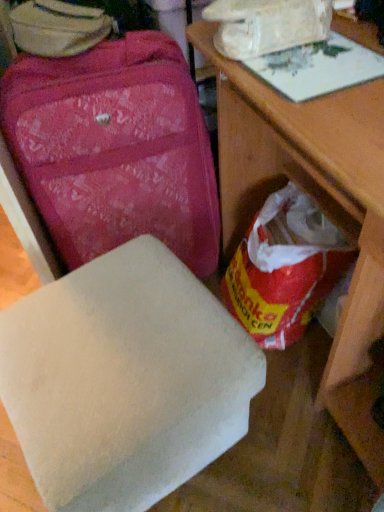
This screenshot has width=384, height=512. What do you see at coordinates (321, 205) in the screenshot? I see `wooden table at center` at bounding box center [321, 205].

What do you see at coordinates (124, 380) in the screenshot? The width and height of the screenshot is (384, 512). I see `white matte foam at lower center` at bounding box center [124, 380].

This screenshot has width=384, height=512. Identify the location of red plastic grocery bag at lower right. (285, 268).

Locate an element on the screen. This screenshot has height=512, width=384. furniture located on the left of red plastic grocery bag at lower right is located at coordinates (124, 380).

Is point (113, 471) positioned in front of point (266, 277)?

That is True.

Measure the distance from white matte foam at lower center to red plastic grocery bag at lower right.

They are 16.20 inches apart.

Based on the photo, is wooden table at center turned away from white matte foam at lower center?

wooden table at center does not have its back to white matte foam at lower center.

Would you say wooden table at center is inside or outside white matte foam at lower center?

wooden table at center is located beyond the bounds of white matte foam at lower center.

Which object is thinner, wooden table at center or white matte foam at lower center?

white matte foam at lower center is thinner.

Does wooden table at center have a larger size compared to white matte foam at lower center?

Yes, wooden table at center is bigger than white matte foam at lower center.

Where is `grocery bag beneath the matte pink suitcase at upper left (from a real-world perspective)`? This screenshot has height=512, width=384. grocery bag beneath the matte pink suitcase at upper left (from a real-world perspective) is located at coordinates (285, 268).

In terms of size, does matte pink suitcase at upper left appear bigger or smaller than red plastic grocery bag at lower right?

Considering their sizes, matte pink suitcase at upper left takes up more space than red plastic grocery bag at lower right.

Choose the correct answer: Is matte pink suitcase at upper left inside red plastic grocery bag at lower right or outside it?

matte pink suitcase at upper left is not enclosed by red plastic grocery bag at lower right.

Considering the relative positions of wooden table at center and red plastic grocery bag at lower right in the image provided, is wooden table at center to the right of red plastic grocery bag at lower right from the viewer's perspective?

Yes.

Are wooden table at center and red plastic grocery bag at lower right located far from each other?

wooden table at center is near red plastic grocery bag at lower right, not far away.

From a real-world perspective, is wooden table at center physically located above or below red plastic grocery bag at lower right?

In terms of real-world spatial position, wooden table at center is above red plastic grocery bag at lower right.

In terms of height, does wooden table at center look taller or shorter compared to red plastic grocery bag at lower right?

Considering their sizes, wooden table at center has more height than red plastic grocery bag at lower right.

Is matte pink suitcase at upper left behind wooden table at center?

Yes, matte pink suitcase at upper left is further from the viewer.

From a real-world perspective, is matte pink suitcase at upper left on top of wooden table at center?

No.

Is matte pink suitcase at upper left smaller than wooden table at center?

Indeed, matte pink suitcase at upper left has a smaller size compared to wooden table at center.

From the picture: Which object is positioned more to the right, matte pink suitcase at upper left or wooden table at center?

wooden table at center.

Can you confirm if red plastic grocery bag at lower right is wider than matte pink suitcase at upper left?

Incorrect, the width of red plastic grocery bag at lower right does not surpass that of matte pink suitcase at upper left.

Which is behind, red plastic grocery bag at lower right or matte pink suitcase at upper left?

red plastic grocery bag at lower right is more distant.

Which point is more distant from viewer, (x=45, y=449) or (x=361, y=216)?

Positioned behind is point (x=361, y=216).

From the picture: Which object is further away from the camera taking this photo, white matte foam at lower center or wooden table at center?

white matte foam at lower center.

Is white matte foam at lower center facing away from wooden table at center?

That's right, white matte foam at lower center is facing away from wooden table at center.

The width and height of the screenshot is (384, 512). What are the coordinates of `furniture that is on the left side of red plastic grocery bag at lower right` in the screenshot? It's located at (124, 380).

I want to click on furniture below the wooden table at center (from the image's perspective), so click(x=124, y=380).

Estimate the real-world distances between objects in this image. Which object is further from matte pink suitcase at upper left, wooden table at center or red plastic grocery bag at lower right?

The object further to matte pink suitcase at upper left is red plastic grocery bag at lower right.

Based on their spatial positions, is matte pink suitcase at upper left or white matte foam at lower center closer to wooden table at center?

The object closer to wooden table at center is matte pink suitcase at upper left.

Which object lies nearer to the anchor point matte pink suitcase at upper left, wooden table at center or white matte foam at lower center?

Based on the image, wooden table at center appears to be nearer to matte pink suitcase at upper left.

Estimate the real-world distances between objects in this image. Which object is closer to white matte foam at lower center, wooden table at center or matte pink suitcase at upper left?

wooden table at center is closer to white matte foam at lower center.

When comparing their distances from red plastic grocery bag at lower right, does wooden table at center or white matte foam at lower center seem closer?

wooden table at center is closer to red plastic grocery bag at lower right.

Based on their spatial positions, is matte pink suitcase at upper left or wooden table at center closer to white matte foam at lower center?

wooden table at center.

Estimate the real-world distances between objects in this image. Which object is further from white matte foam at lower center, wooden table at center or red plastic grocery bag at lower right?

red plastic grocery bag at lower right lies further to white matte foam at lower center than the other object.

Considering their positions, is white matte foam at lower center positioned closer to matte pink suitcase at upper left than wooden table at center?

wooden table at center lies closer to matte pink suitcase at upper left than the other object.

This screenshot has width=384, height=512. I want to click on furniture between matte pink suitcase at upper left and red plastic grocery bag at lower right from left to right, so click(x=124, y=380).

In order to click on furniture between matte pink suitcase at upper left and wooden table at center from left to right in this screenshot , I will do `click(124, 380)`.

Find the location of a particular element. suitcase located between wooden table at center and red plastic grocery bag at lower right in the depth direction is located at coordinates (115, 149).

Identify the location of furniture between wooden table at center and red plastic grocery bag at lower right from front to back. Image resolution: width=384 pixels, height=512 pixels. (124, 380).